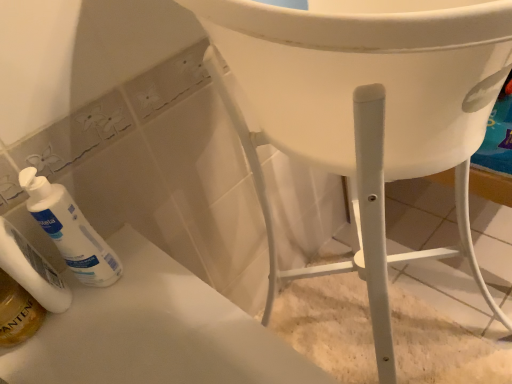
Question: In terms of size, does translucent golden mouthwash at lower left appear bigger or smaller than white matte pump bottle at lower left?

Choices:
 (A) small
 (B) big

Answer: (A)

Question: From the image's perspective, is translucent golden mouthwash at lower left located above or below white matte pump bottle at lower left?

Choices:
 (A) below
 (B) above

Answer: (A)

Question: Based on their relative distances, which object is farther from the translucent golden mouthwash at lower left?

Choices:
 (A) white matte pump bottle at lower left
 (B) white matte lotion at lower left
 (C) white plastic chair at lower right

Answer: (C)

Question: Considering the real-world distances, which object is farthest from the white matte pump bottle at lower left?

Choices:
 (A) white plastic chair at lower right
 (B) translucent golden mouthwash at lower left
 (C) white matte lotion at lower left

Answer: (A)